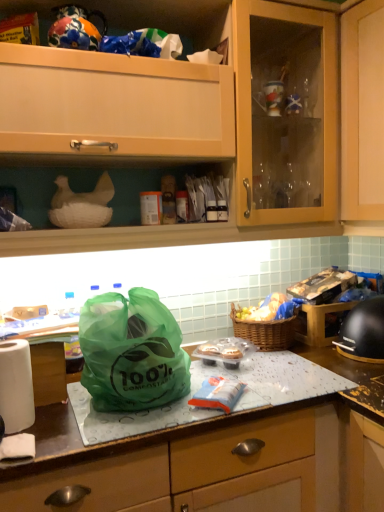
Question: Is woven brown picnic basket at center to the left of white paper towel at left from the viewer's perspective?

Choices:
 (A) yes
 (B) no

Answer: (B)

Question: From the image's perspective, is woven brown picnic basket at center under white paper towel at left?

Choices:
 (A) yes
 (B) no

Answer: (B)

Question: Is woven brown picnic basket at center further to camera compared to white paper towel at left?

Choices:
 (A) yes
 (B) no

Answer: (A)

Question: Is the position of woven brown picnic basket at center less distant than that of white paper towel at left?

Choices:
 (A) no
 (B) yes

Answer: (A)

Question: From a real-world perspective, is woven brown picnic basket at center on white paper towel at left?

Choices:
 (A) yes
 (B) no

Answer: (B)

Question: From a real-world perspective, is woven brown picnic basket at center beneath white paper towel at left?

Choices:
 (A) yes
 (B) no

Answer: (A)

Question: Can you confirm if black matte helmet at right is taller than white paper towel at left?

Choices:
 (A) yes
 (B) no

Answer: (B)

Question: Is the position of black matte helmet at right more distant than that of white paper towel at left?

Choices:
 (A) yes
 (B) no

Answer: (A)

Question: Does black matte helmet at right have a lesser height compared to white paper towel at left?

Choices:
 (A) no
 (B) yes

Answer: (B)

Question: Could white paper towel at left be considered to be inside black matte helmet at right?

Choices:
 (A) yes
 (B) no

Answer: (B)

Question: Is black matte helmet at right turned away from white paper towel at left?

Choices:
 (A) no
 (B) yes

Answer: (A)

Question: From the image's perspective, does black matte helmet at right appear lower than white paper towel at left?

Choices:
 (A) yes
 (B) no

Answer: (B)

Question: Does matte wood cabinet at upper center have a smaller size compared to white paper towel at left?

Choices:
 (A) yes
 (B) no

Answer: (B)